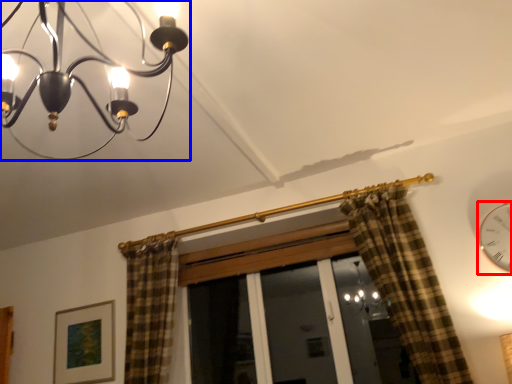
Question: Which of the following is the farthest to the observer, clock (highlighted by a red box) or lamp (highlighted by a blue box)?

Choices:
 (A) clock
 (B) lamp

Answer: (A)